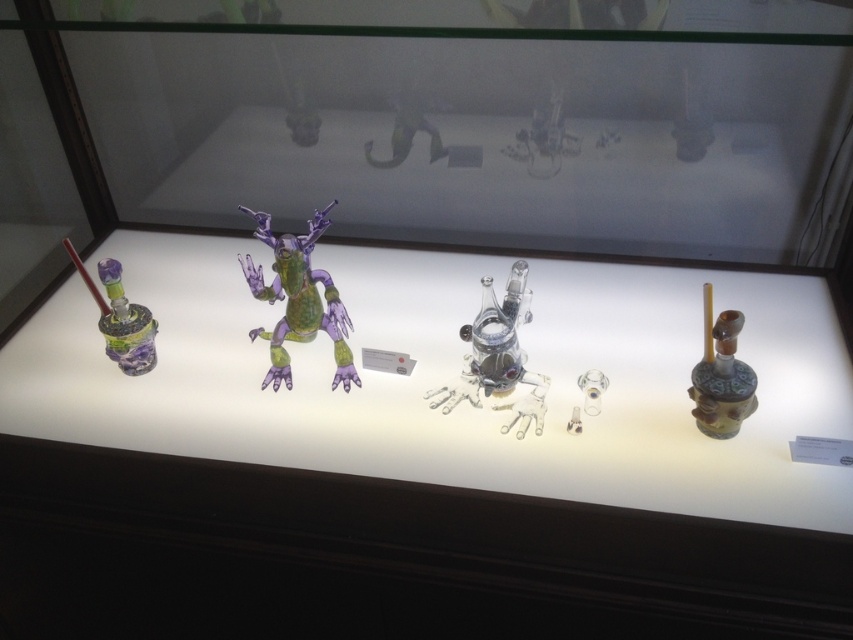
Is point (334, 378) positioned in front of point (709, 282)?

No, it is not.

Does translucent purple toy at center have a larger size compared to green matte glass bottle at right?

Yes, translucent purple toy at center is bigger than green matte glass bottle at right.

Measure the distance between translucent purple toy at center and camera.

A distance of 92.67 centimeters exists between translucent purple toy at center and camera.

Locate an element on the screen. The width and height of the screenshot is (853, 640). translucent purple toy at center is located at coordinates (299, 300).

Is point (479, 314) in front of point (712, 390)?

No, (479, 314) is further to viewer.

This screenshot has width=853, height=640. In order to click on transparent glass frog at center in this screenshot , I will do `click(498, 355)`.

Which is behind, point (485, 280) or point (711, 408)?

The point (485, 280) is more distant.

Where is `transparent glass frog at center`? This screenshot has height=640, width=853. transparent glass frog at center is located at coordinates (498, 355).

Can you confirm if green matte glass bottle at right is bigger than matte green glass pipe at left?

Incorrect, green matte glass bottle at right is not larger than matte green glass pipe at left.

Who is more distant from viewer, (738, 419) or (102, 332)?

The point (102, 332) is behind.

Which is in front, point (732, 326) or point (152, 348)?

Point (732, 326) is more forward.

Locate an element on the screen. Image resolution: width=853 pixels, height=640 pixels. green matte glass bottle at right is located at coordinates (721, 376).